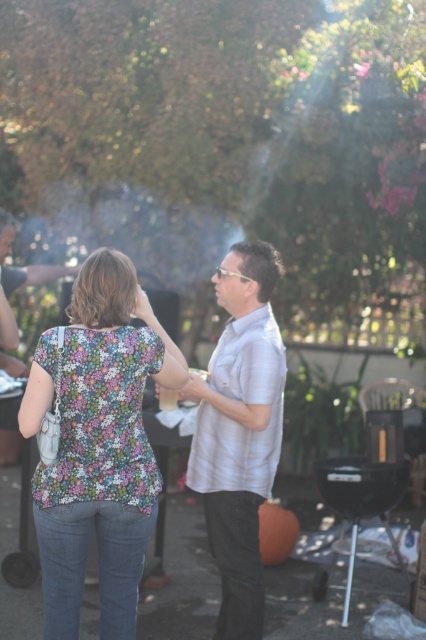
You are at a barbecue and see two people talking. One is wearing a floral fabric blouse at center and the other a light gray shirt at center. Which one is standing to the left?

The floral fabric blouse at center is positioned on the left side of light gray shirt at center, so the person wearing the floral fabric blouse at center is standing to the left.

You are organizing a photo shoot and need to ensure that the floral fabric blouse at center and the light gray shirt at center are visible in the frame. Given that the camera has a fixed focal length and the shirts are currently positioned side by side, which shirt might require adjusting its position to ensure both are fully visible?

The floral fabric blouse at center has a larger width than the light gray shirt at center, so it might require adjusting its position to ensure both are fully visible in the frame.

You are a photographer at this gathering and want to take a photo of both the floral fabric blouse at center and the light gray shirt at center. The minimum distance required for your camera to focus on two subjects is 60 centimeters. Do you think you can capture both clearly in one shot?

The floral fabric blouse at center and the light gray shirt at center are 57.28 centimeters apart, which is less than the 60 centimeter minimum required for the camera to focus on two subjects. Therefore, you may not be able to capture both clearly in one shot.